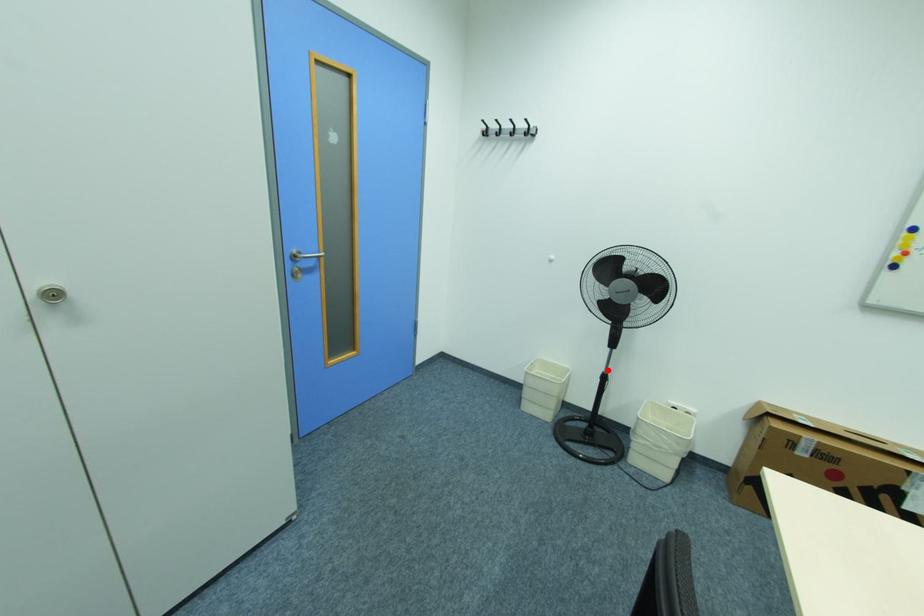
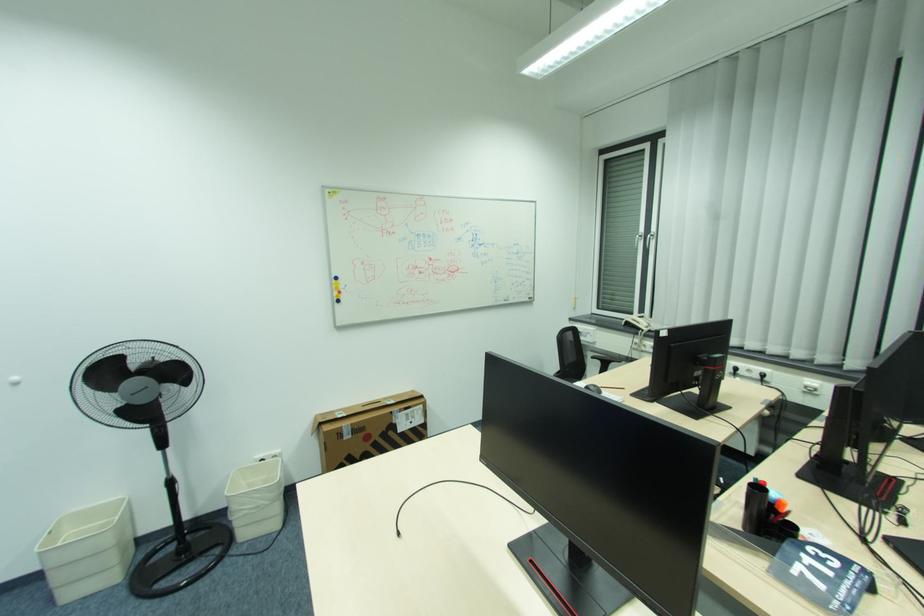
Where in the second image is the point corresponding to the highlighted location from the first image?

(169, 477)